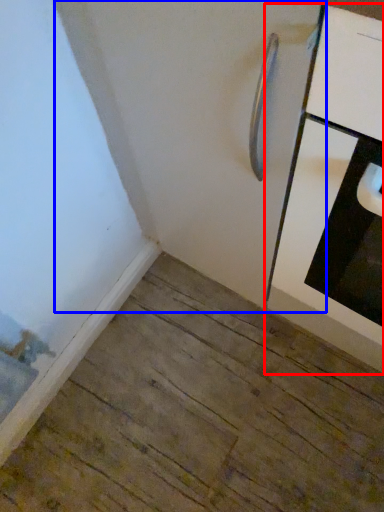
Question: Among these objects, which one is farthest to the camera, cabinetry (highlighted by a red box) or door (highlighted by a blue box)?

Choices:
 (A) cabinetry
 (B) door

Answer: (B)